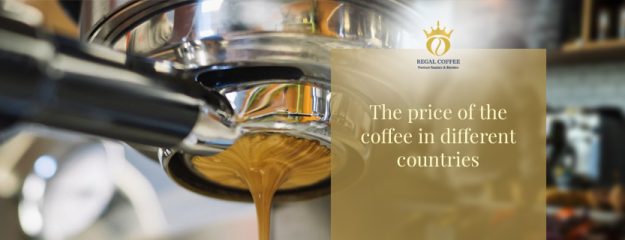
In order to click on more coffee equipment in this screenshot , I will do `click(582, 147)`.